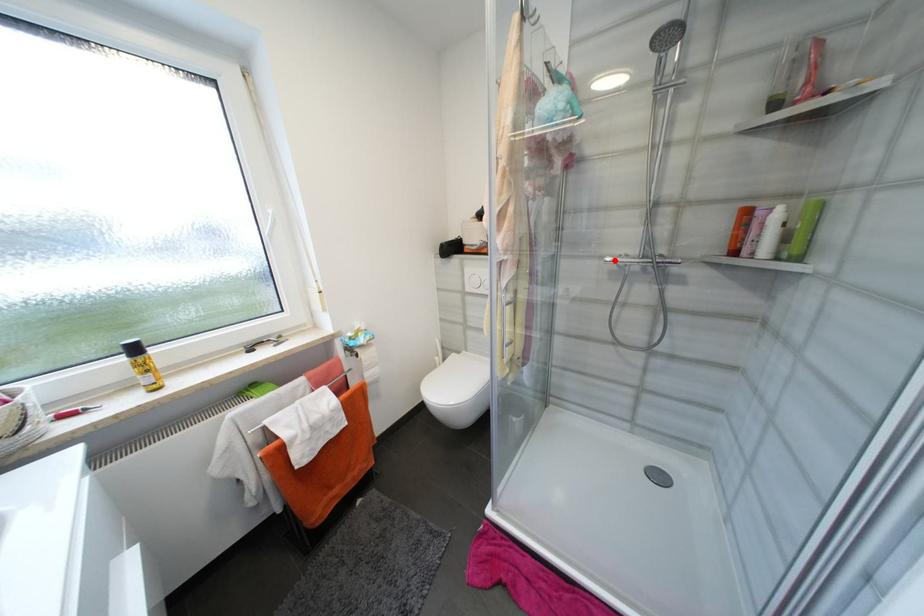
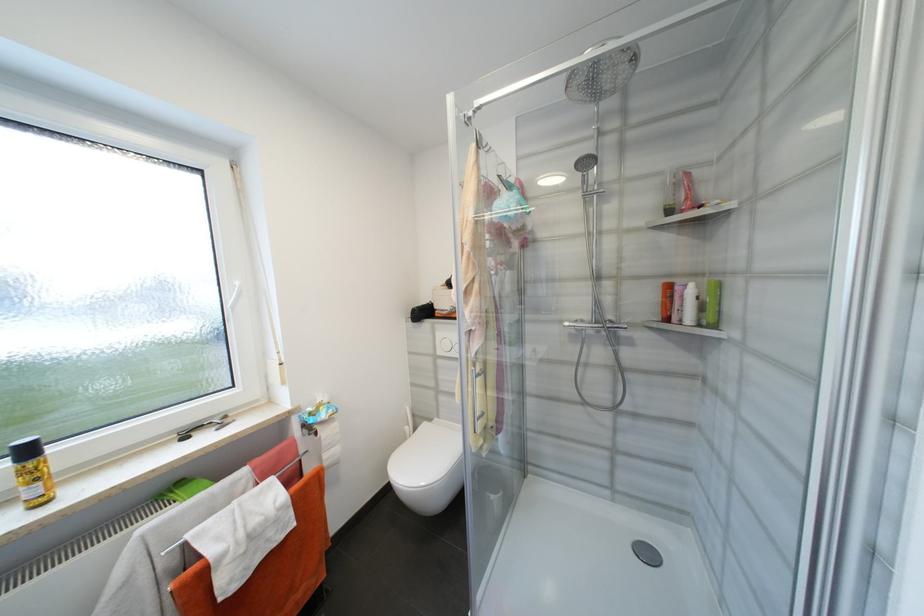
Find the pixel in the second image that matches the highlighted location in the first image.

(573, 325)